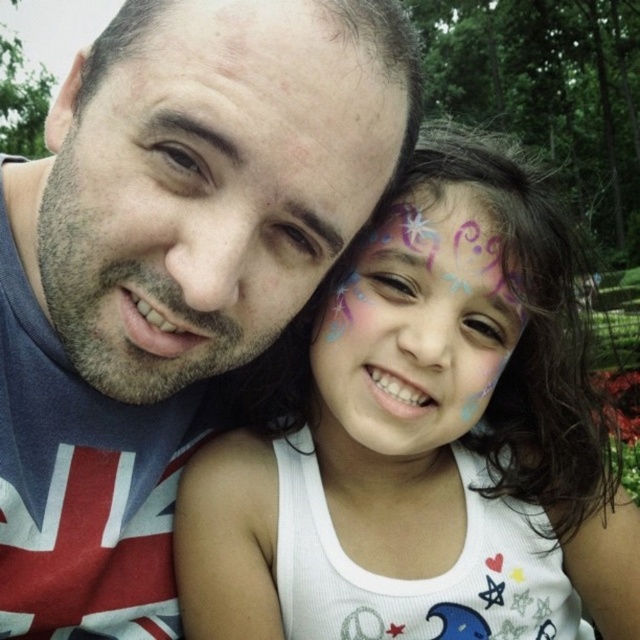
Question: Is matte blue t-shirt at left to the right of white matte face paint at center from the viewer's perspective?

Choices:
 (A) no
 (B) yes

Answer: (A)

Question: Considering the real-world distances, which object is farthest from the white matte face paint at center?

Choices:
 (A) matte blue t-shirt at left
 (B) pastel painted face at center

Answer: (A)

Question: Can you confirm if white matte face paint at center is positioned to the right of pastel painted face at center?

Choices:
 (A) no
 (B) yes

Answer: (B)

Question: Which object is farther from the camera taking this photo?

Choices:
 (A) matte blue t-shirt at left
 (B) pastel painted face at center

Answer: (B)

Question: Is matte blue t-shirt at left positioned in front of white matte face paint at center?

Choices:
 (A) yes
 (B) no

Answer: (A)

Question: Which of the following is the farthest from the observer?

Choices:
 (A) (67, 483)
 (B) (458, 230)
 (C) (419, 604)

Answer: (C)